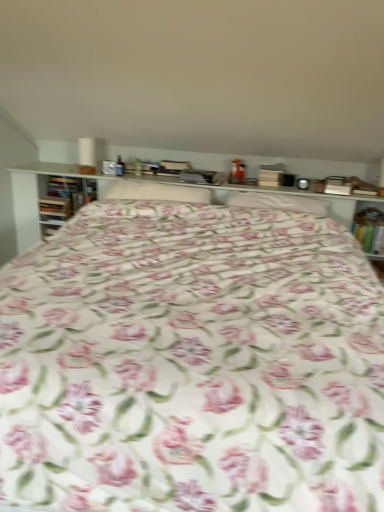
Question: From a real-world perspective, is white fabric pillow at center, the first pillow viewed from the left, beneath hardcover book at left, which appears as the 2th book when viewed from the right?

Choices:
 (A) yes
 (B) no

Answer: (B)

Question: Are white fabric pillow at center, which is the second pillow in right-to-left order, and hardcover book at left, acting as the second book starting from the left, making contact?

Choices:
 (A) no
 (B) yes

Answer: (A)

Question: From a real-world perspective, is white fabric pillow at center, the first pillow viewed from the left, on top of hardcover book at left, which appears as the 2th book when viewed from the right?

Choices:
 (A) no
 (B) yes

Answer: (B)

Question: Considering the relative sizes of white fabric pillow at center, the first pillow viewed from the left, and hardcover book at left, which appears as the 2th book when viewed from the right, in the image provided, is white fabric pillow at center, the first pillow viewed from the left, bigger than hardcover book at left, which appears as the 2th book when viewed from the right,?

Choices:
 (A) yes
 (B) no

Answer: (A)

Question: From the image's perspective, is white fabric pillow at center, the first pillow viewed from the left, below hardcover book at left, which appears as the 2th book when viewed from the right?

Choices:
 (A) yes
 (B) no

Answer: (A)

Question: From the image's perspective, is floral fabric bed at center above or below wooden book at left, which is the first book in left-to-right order?

Choices:
 (A) above
 (B) below

Answer: (B)

Question: In terms of size, does floral fabric bed at center appear bigger or smaller than wooden book at left, which is the first book in left-to-right order?

Choices:
 (A) small
 (B) big

Answer: (B)

Question: Considering the relative positions of floral fabric bed at center and wooden book at left, which appears as the third book when viewed from the right, in the image provided, is floral fabric bed at center to the left or to the right of wooden book at left, which appears as the third book when viewed from the right,?

Choices:
 (A) left
 (B) right

Answer: (B)

Question: Is floral fabric bed at center in front of or behind wooden book at left, which is the first book in left-to-right order, in the image?

Choices:
 (A) front
 (B) behind

Answer: (A)

Question: Is floral fabric pillow at center, the first pillow when ordered from right to left, taller or shorter than floral fabric bed at center?

Choices:
 (A) tall
 (B) short

Answer: (B)

Question: From the image's perspective, relative to floral fabric bed at center, is floral fabric pillow at center, which is counted as the second pillow, starting from the left, above or below?

Choices:
 (A) below
 (B) above

Answer: (B)

Question: Looking at their shapes, would you say floral fabric pillow at center, the first pillow when ordered from right to left, is wider or thinner than floral fabric bed at center?

Choices:
 (A) thin
 (B) wide

Answer: (A)

Question: Visually, is floral fabric pillow at center, the first pillow when ordered from right to left, positioned to the left or to the right of floral fabric bed at center?

Choices:
 (A) right
 (B) left

Answer: (A)

Question: From a real-world perspective, is hardcover book at left, which appears as the 2th book when viewed from the right, physically located above or below white fabric pillow at center, which is the second pillow in right-to-left order?

Choices:
 (A) above
 (B) below

Answer: (B)

Question: Would you say hardcover book at left, which appears as the 2th book when viewed from the right, is to the left or to the right of white fabric pillow at center, which is the second pillow in right-to-left order, in the picture?

Choices:
 (A) left
 (B) right

Answer: (A)